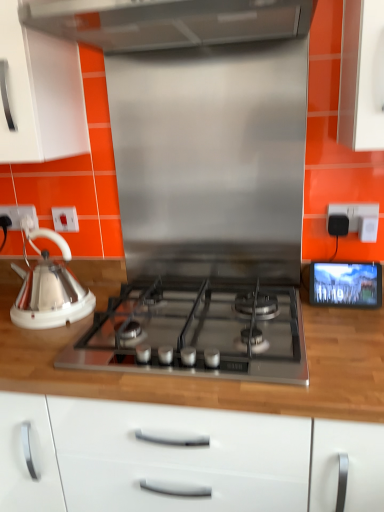
Question: Would you say satin silver gas stove at center is outside white plastic socket at left, acting as the 1th electric outlet starting from the left?

Choices:
 (A) yes
 (B) no

Answer: (A)

Question: From the image's perspective, would you say satin silver gas stove at center is positioned over white plastic socket at left, the third electric outlet viewed from the front?

Choices:
 (A) yes
 (B) no

Answer: (B)

Question: Is satin silver gas stove at center turned away from white plastic socket at left, the first electric outlet when ordered from back to front?

Choices:
 (A) yes
 (B) no

Answer: (B)

Question: Is white plastic socket at left, the first electric outlet when ordered from back to front, located within satin silver gas stove at center?

Choices:
 (A) no
 (B) yes

Answer: (A)

Question: Is satin silver gas stove at center not near white plastic socket at left, the third electric outlet viewed from the front?

Choices:
 (A) yes
 (B) no

Answer: (B)

Question: Choose the correct answer: Is satin silver gas stove at center inside wooden at left or outside it?

Choices:
 (A) outside
 (B) inside

Answer: (B)

Question: Relative to wooden at left, is satin silver gas stove at center in front or behind?

Choices:
 (A) front
 (B) behind

Answer: (B)

Question: Is point (170, 316) closer or farther from the camera than point (132, 382)?

Choices:
 (A) closer
 (B) farther

Answer: (B)

Question: Would you say satin silver gas stove at center is to the left or to the right of wooden at left in the picture?

Choices:
 (A) left
 (B) right

Answer: (B)

Question: In the image, is white glossy kettle at left positioned in front of or behind wooden at left?

Choices:
 (A) behind
 (B) front

Answer: (A)

Question: From a real-world perspective, relative to wooden at left, is white glossy kettle at left vertically above or below?

Choices:
 (A) above
 (B) below

Answer: (A)

Question: Is white glossy kettle at left taller or shorter than wooden at left?

Choices:
 (A) tall
 (B) short

Answer: (B)

Question: Considering the relative positions of white glossy kettle at left and wooden at left in the image provided, is white glossy kettle at left to the left or to the right of wooden at left?

Choices:
 (A) left
 (B) right

Answer: (A)

Question: Looking at the image, does black plastic electric outlet at upper right, which ranks as the third electric outlet in left-to-right order, seem bigger or smaller compared to wooden at left?

Choices:
 (A) small
 (B) big

Answer: (A)

Question: Considering the relative positions of black plastic electric outlet at upper right, which ranks as the third electric outlet in left-to-right order, and wooden at left in the image provided, is black plastic electric outlet at upper right, which ranks as the third electric outlet in left-to-right order, to the left or to the right of wooden at left?

Choices:
 (A) left
 (B) right

Answer: (B)